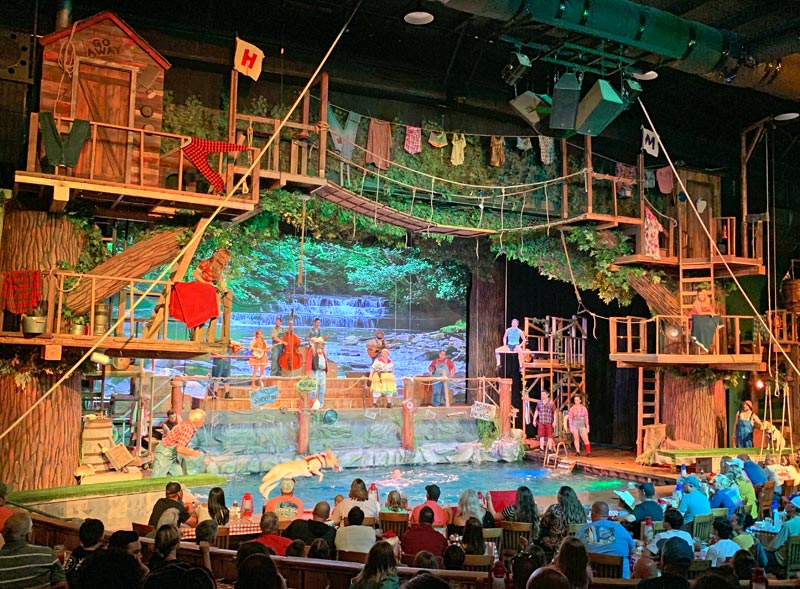
At what (x,y) coordinates should I click in order to perform the action: click on stage. Please return your answer as a coordinate pair (x, y). Looking at the image, I should click on (340, 389).